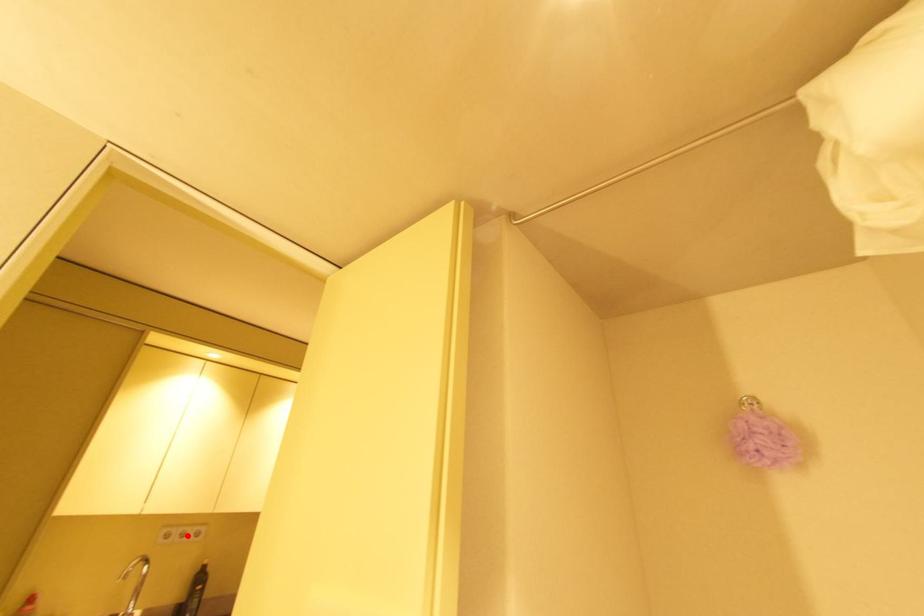
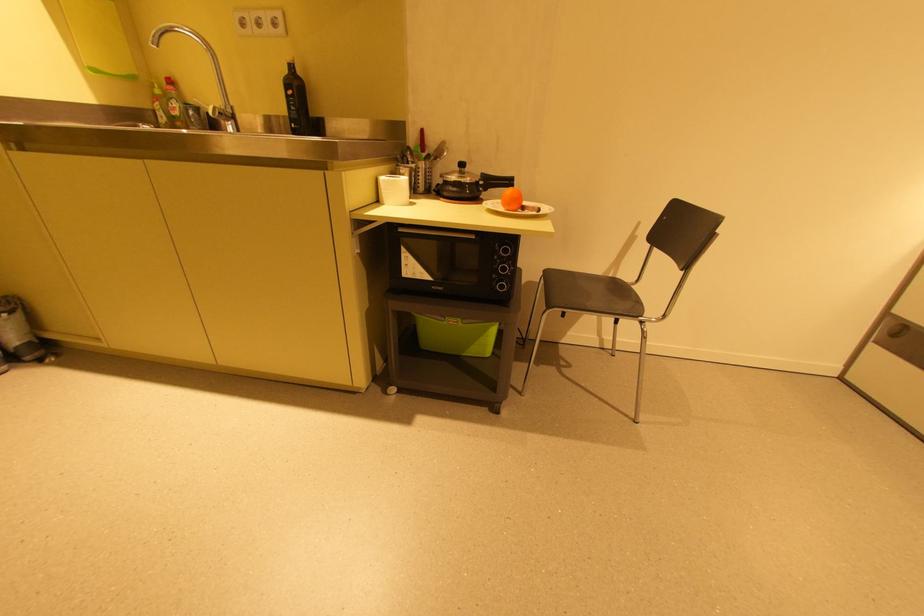
Where in the second image is the point corresponding to the highlighted location from the first image?

(263, 23)